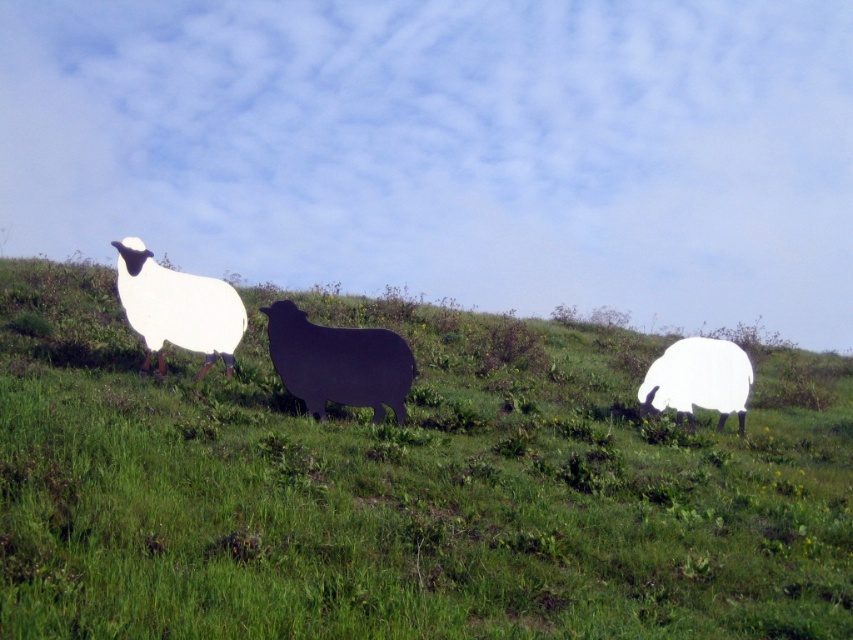
Does green grassy at center appear on the left side of white matte sheep at right?

Correct, you'll find green grassy at center to the left of white matte sheep at right.

Between point (190, 547) and point (724, 349), which one is positioned in front?

Positioned in front is point (190, 547).

The image size is (853, 640). What are the coordinates of `green grassy at center` in the screenshot? It's located at (405, 486).

Is white matte sheep at left positioned before white matte sheep at right?

Yes.

Consider the image. Between white matte sheep at left and white matte sheep at right, which one appears on the left side from the viewer's perspective?

From the viewer's perspective, white matte sheep at left appears more on the left side.

Is point (149, 332) positioned in front of point (688, 358)?

Yes, point (149, 332) is closer to viewer.

Locate an element on the screen. Image resolution: width=853 pixels, height=640 pixels. white matte sheep at left is located at coordinates (177, 307).

Can you confirm if green grassy at center is positioned to the right of black matte sheep at center?

Correct, you'll find green grassy at center to the right of black matte sheep at center.

Is green grassy at center shorter than black matte sheep at center?

Incorrect, green grassy at center's height does not fall short of black matte sheep at center's.

Find the location of a particular element. This screenshot has width=853, height=640. green grassy at center is located at coordinates (405, 486).

What are the coordinates of `green grassy at center` in the screenshot? It's located at (405, 486).